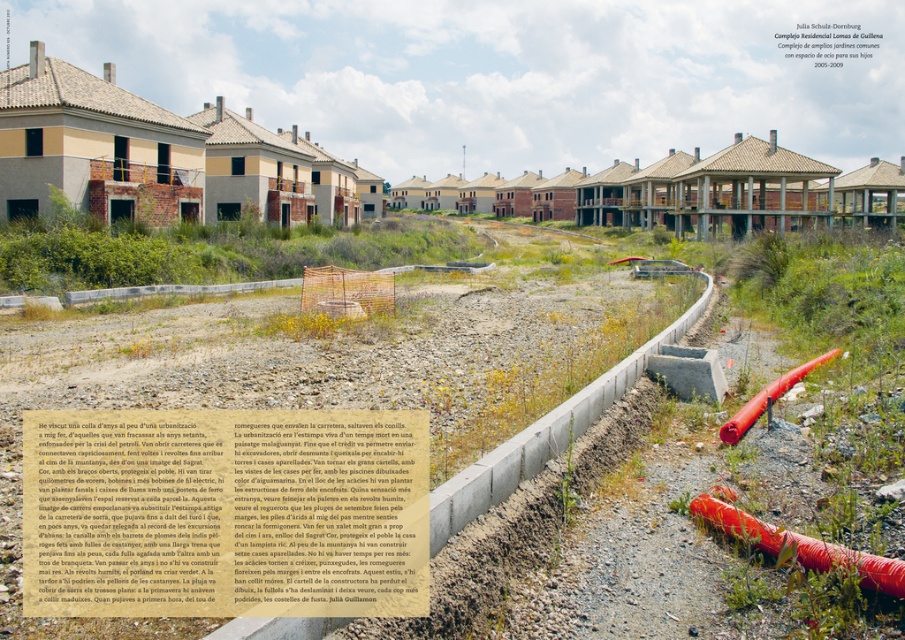
Who is shorter, rubber hose at center or red rubber hose at center right?

Standing shorter between the two is rubber hose at center.

Does rubber hose at center lie behind red rubber hose at center right?

That is False.

The width and height of the screenshot is (905, 640). What are the coordinates of `rubber hose at center` in the screenshot? It's located at (796, 541).